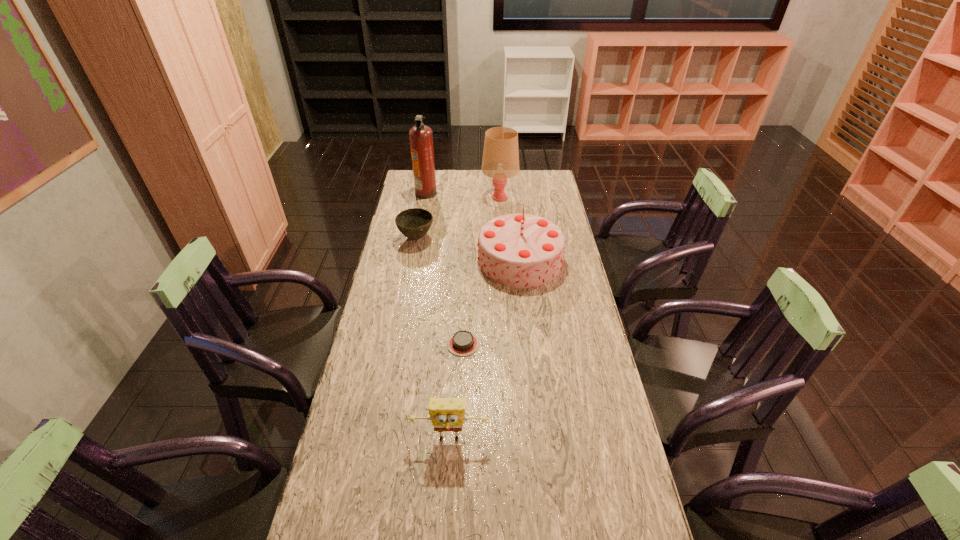
Where is `vacant space that satisfies the following two spatial constraints: 1. at the nozzle of the tallest object; 2. on the back side of the chocolate cake`? The image size is (960, 540). vacant space that satisfies the following two spatial constraints: 1. at the nozzle of the tallest object; 2. on the back side of the chocolate cake is located at coordinates (399, 343).

What are the coordinates of `vacant area that satisfies the following two spatial constraints: 1. at the nozzle of the fire extinguisher; 2. on the right side of the chocolate cake` in the screenshot? It's located at (399, 343).

Locate an element on the screen. The image size is (960, 540). blank area in the image that satisfies the following two spatial constraints: 1. at the nozzle of the fire extinguisher; 2. on the back side of the chocolate cake is located at coordinates (399, 343).